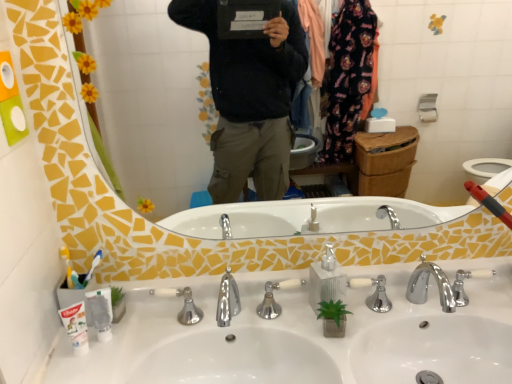
What do you see at coordinates (448, 86) in the screenshot? I see `yellow mosaic mirror at upper center` at bounding box center [448, 86].

The height and width of the screenshot is (384, 512). What are the coordinates of `white plastic toothbrush at left` in the screenshot? It's located at (92, 267).

Image resolution: width=512 pixels, height=384 pixels. Identify the location of silver metallic soap dispenser at center. (326, 280).

In order to click on yellow mosaic mirror at upper center in this screenshot , I will do `click(448, 86)`.

Considering the sizes of objects white plastic toothbrush at left and polished chrome faucet at center in the image provided, who is taller, white plastic toothbrush at left or polished chrome faucet at center?

polished chrome faucet at center is taller.

Is white plastic toothbrush at left next to polished chrome faucet at center?

There is a gap between white plastic toothbrush at left and polished chrome faucet at center.

Where is `toothbrush lying behind the polished chrome faucet at center`? The image size is (512, 384). toothbrush lying behind the polished chrome faucet at center is located at coordinates (92, 267).

Would you say white plastic toothbrush at left is inside or outside yellow mosaic mirror at upper center?

white plastic toothbrush at left is not inside yellow mosaic mirror at upper center, it's outside.

Between white plastic toothbrush at left and yellow mosaic mirror at upper center, which one has smaller size?

white plastic toothbrush at left is smaller.

From a real-world perspective, is white plastic toothbrush at left positioned over yellow mosaic mirror at upper center based on gravity?

No, from a real-world perspective, white plastic toothbrush at left is not above yellow mosaic mirror at upper center.

Can you confirm if white plastic toothbrush at left is positioned to the right of yellow mosaic mirror at upper center?

No.

Is white matte toothpaste at lower left next to white plastic toothbrush at left?

Yes, white matte toothpaste at lower left is right next to white plastic toothbrush at left and making contact.

Which object is thinner, white matte toothpaste at lower left or white plastic toothbrush at left?

Thinner between the two is white plastic toothbrush at left.

Is white matte toothpaste at lower left surrounding white plastic toothbrush at left?

Definitely not — white plastic toothbrush at left is not inside white matte toothpaste at lower left.

From a real-world perspective, is white matte toothpaste at lower left beneath white plastic toothbrush at left?

Yes.

Is the surface of white plastic toothbrush at left in direct contact with silver metallic soap dispenser at center?

white plastic toothbrush at left and silver metallic soap dispenser at center are not in contact.

In terms of width, does white plastic toothbrush at left look wider or thinner when compared to silver metallic soap dispenser at center?

Clearly, white plastic toothbrush at left has less width compared to silver metallic soap dispenser at center.

From the image's perspective, is white plastic toothbrush at left positioned above or below silver metallic soap dispenser at center?

white plastic toothbrush at left is above silver metallic soap dispenser at center.

Can you confirm if white plastic toothbrush at left is smaller than silver metallic soap dispenser at center?

Yes, white plastic toothbrush at left is smaller than silver metallic soap dispenser at center.

Considering the relative sizes of yellow mosaic mirror at upper center and white plastic toothbrush at left in the image provided, is yellow mosaic mirror at upper center smaller than white plastic toothbrush at left?

No.

Is yellow mosaic mirror at upper center aimed at white plastic toothbrush at left?

Yes, yellow mosaic mirror at upper center faces towards white plastic toothbrush at left.

I want to click on toiletry on the left of yellow mosaic mirror at upper center, so click(101, 312).

Can you see yellow mosaic mirror at upper center touching white plastic toothbrush at left?

No.

Can you confirm if yellow mosaic mirror at upper center is shorter than white plastic toothbrush at left?

No, yellow mosaic mirror at upper center is not shorter than white plastic toothbrush at left.

How many degrees apart are the facing directions of yellow mosaic mirror at upper center and white plastic toothbrush at left?

There is a 0.712-degree angle between the facing directions of yellow mosaic mirror at upper center and white plastic toothbrush at left.

From the image's perspective, between yellow mosaic mirror at upper center and white plastic toothbrush at left, who is located below?

white plastic toothbrush at left.

From a real-world perspective, between white matte toothpaste at lower left and yellow mosaic mirror at upper center, who is vertically lower?

white matte toothpaste at lower left is physically lower.

The width and height of the screenshot is (512, 384). What are the coordinates of `mirror that appears on the right of white matte toothpaste at lower left` in the screenshot? It's located at (448, 86).

From the image's perspective, which is below, white matte toothpaste at lower left or yellow mosaic mirror at upper center?

white matte toothpaste at lower left.

Identify the location of toothbrush that is above the polished chrome faucet at center (from the image's perspective). This screenshot has width=512, height=384. (92, 267).

Where is `toiletry behind the yellow mosaic mirror at upper center`? This screenshot has width=512, height=384. toiletry behind the yellow mosaic mirror at upper center is located at coordinates (101, 312).

Based on their spatial positions, is white plastic toothbrush at left or white plastic toothbrush at left further from silver metallic soap dispenser at center?

white plastic toothbrush at left lies further to silver metallic soap dispenser at center than the other object.

Which object lies nearer to the anchor point silver metallic soap dispenser at center, white matte toothpaste at lower left or yellow mosaic mirror at upper center?

white matte toothpaste at lower left is positioned closer to the anchor silver metallic soap dispenser at center.

From the image, which object appears to be farther from polished chrome faucet at center, white matte toothpaste at lower left or white plastic toothbrush at left?

white matte toothpaste at lower left is further to polished chrome faucet at center.

Which object lies further to the anchor point white plastic toothbrush at left, white matte toothpaste at lower left or yellow mosaic mirror at upper center?

Based on the image, yellow mosaic mirror at upper center appears to be further to white plastic toothbrush at left.

Based on their spatial positions, is white plastic toothbrush at left or white plastic toothbrush at left closer to silver metallic soap dispenser at center?

white plastic toothbrush at left is positioned closer to the anchor silver metallic soap dispenser at center.

When comparing their distances from white matte toothpaste at lower left, does white plastic toothbrush at left or polished chrome faucet at center seem further?

Among the two, polished chrome faucet at center is located further to white matte toothpaste at lower left.

Estimate the real-world distances between objects in this image. Which object is closer to white plastic toothbrush at left, silver metallic soap dispenser at center or white plastic toothbrush at left?

Based on the image, white plastic toothbrush at left appears to be nearer to white plastic toothbrush at left.

Based on their spatial positions, is white plastic toothbrush at left or white plastic toothbrush at left closer to polished chrome faucet at center?

white plastic toothbrush at left is closer to polished chrome faucet at center.

This screenshot has width=512, height=384. In order to click on tap between white plastic toothbrush at left and yellow mosaic mirror at upper center in this screenshot , I will do `click(227, 299)`.

Where is `tap located between white plastic toothbrush at left and silver metallic soap dispenser at center in the left-right direction`? The image size is (512, 384). tap located between white plastic toothbrush at left and silver metallic soap dispenser at center in the left-right direction is located at coordinates (227, 299).

This screenshot has height=384, width=512. Find the location of `toiletry located between white matte toothpaste at lower left and silver metallic soap dispenser at center in the left-right direction`. toiletry located between white matte toothpaste at lower left and silver metallic soap dispenser at center in the left-right direction is located at coordinates (101, 312).

You are a GUI agent. You are given a task and a screenshot of the screen. Output one action in this format:
    pyautogui.click(x=<x>, y=<y>)
    Task: Click on the tap between white plastic toothbrush at left and yellow mosaic mirror at upper center in the horizontal direction
    This screenshot has height=384, width=512.
    Given the screenshot: What is the action you would take?
    pyautogui.click(x=227, y=299)